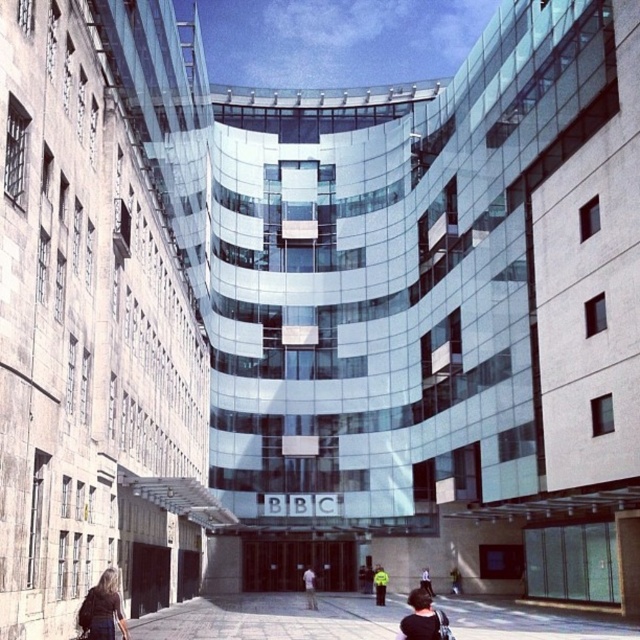
You are a fashion designer observing the modern architectural structure and notice the dark brown leather jacket at lower left and the dark blue jeans at lower center. Which item of clothing appears bigger in size?

The dark brown leather jacket at lower left is larger in size than the dark blue jeans at lower center.

You are standing in front of a modern architectural structure with a curved glass facade. You see a light blue shirt at center. Where is the light blue shirt located in relation to the curved glass facade?

The light blue shirt at center is located at the center of the image, which is part of the curved glass facade area.

You are a construction worker standing at the base of the modern curved glass facade building. You need to reach the yellow reflective jacket at center to retrieve it. The dark blue jeans at lower center marks your current position. Can you safely walk directly to the jacket without any obstacles?

The yellow reflective jacket at center is 7.05 meters away from the dark blue jeans at lower center, which marks your current position. Since there are no mentioned obstacles in the scene description between these two points, you can safely walk directly to the jacket.